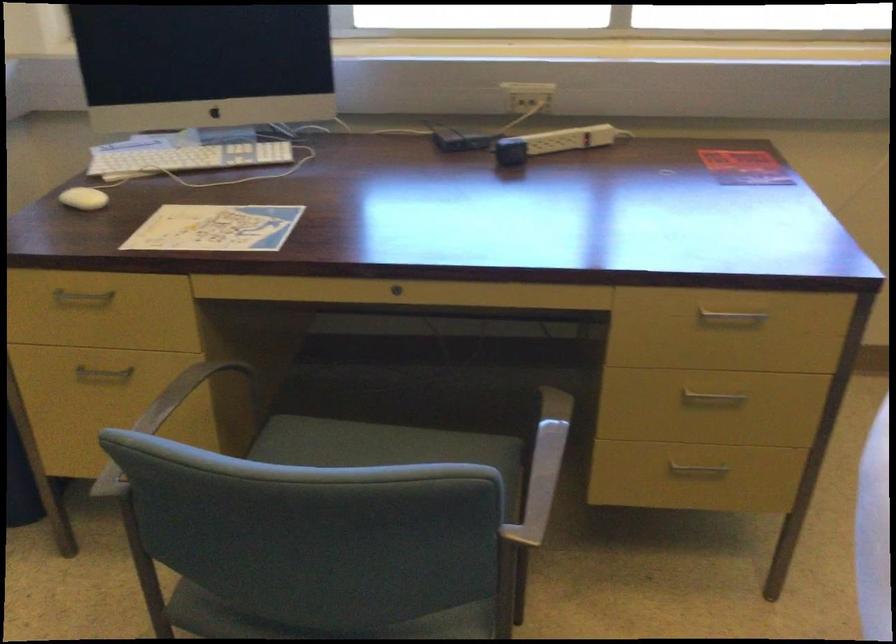
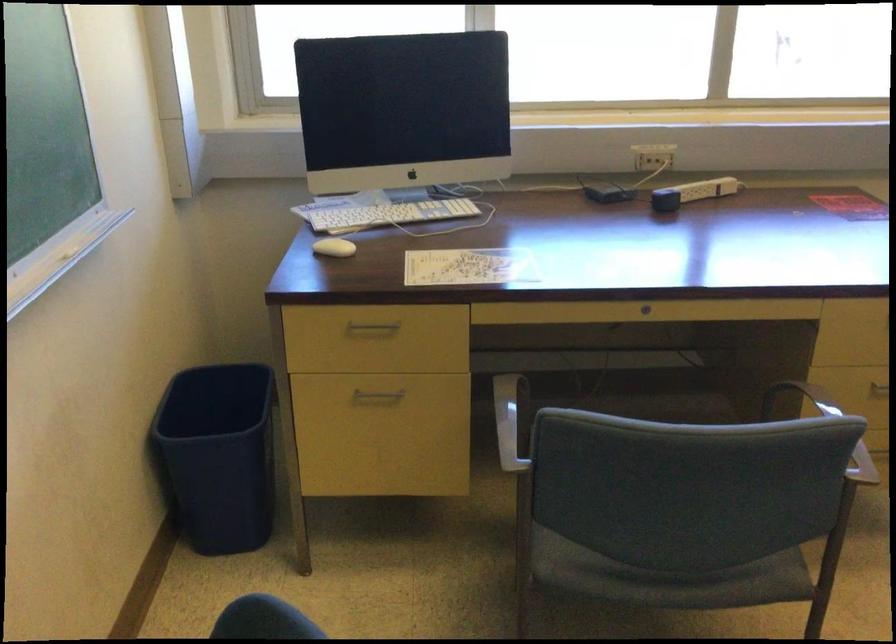
In the second image, find the point that corresponds to point (550, 146) in the first image.

(692, 193)